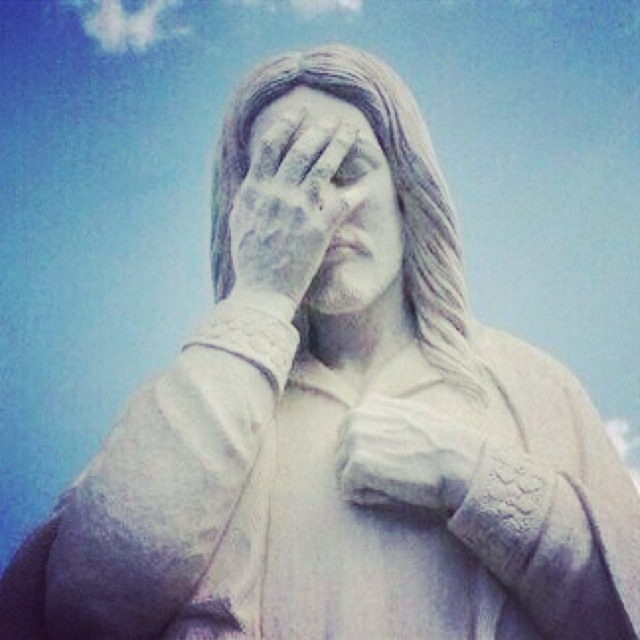
You are an art conservator examining the statue. You notice both the white stone face at center and the white marble eye at center. Which object is closer to you?

The white stone face at center is closer to you than the white marble eye at center.